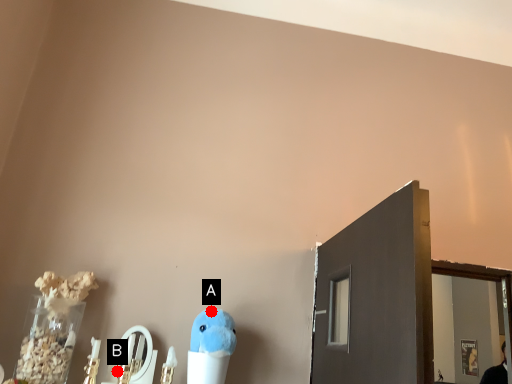
Question: Two points are circled on the image, labeled by A and B beside each circle. Which point appears farthest from the camera in this image?

Choices:
 (A) A is further
 (B) B is further

Answer: (A)